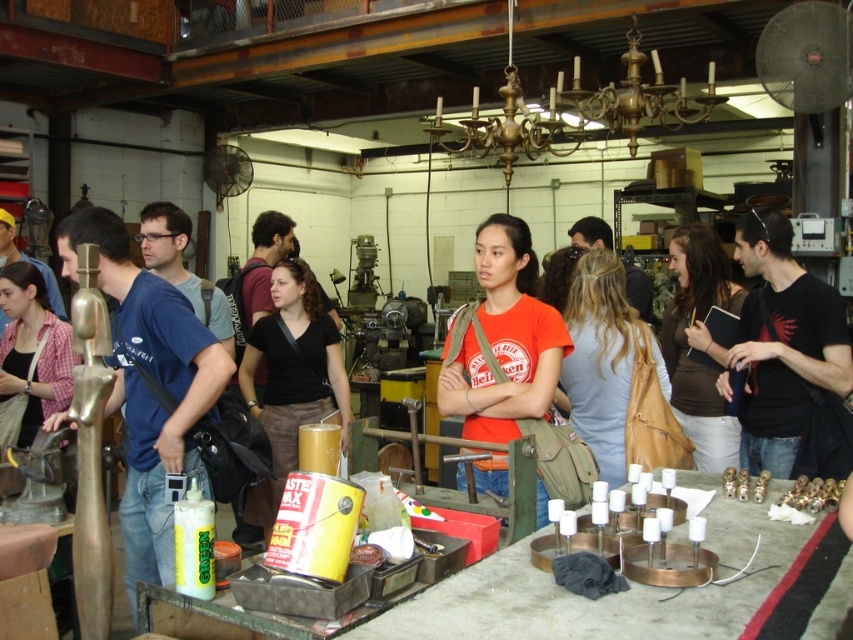
In the scene shown: Does matte gold mannequin at left have a lesser height compared to black matte t-shirt at right?

In fact, matte gold mannequin at left may be taller than black matte t-shirt at right.

Is matte gold mannequin at left to the right of black matte t-shirt at right from the viewer's perspective?

Incorrect, matte gold mannequin at left is not on the right side of black matte t-shirt at right.

Where is `matte gold mannequin at left`? This screenshot has height=640, width=853. matte gold mannequin at left is located at coordinates (146, 387).

Can you confirm if black matte t-shirt at right is wider than light blue fabric at center?

No, black matte t-shirt at right is not wider than light blue fabric at center.

Between point (770, 442) and point (601, 252), which one is positioned behind?

The point (601, 252) is more distant.

What are the coordinates of `black matte t-shirt at right` in the screenshot? It's located at (782, 342).

Is matte gold mannequin at left closer to the viewer compared to orange cotton shirt at center?

No, it is not.

Is matte gold mannequin at left smaller than orange cotton shirt at center?

Incorrect, matte gold mannequin at left is not smaller in size than orange cotton shirt at center.

Where is `matte gold mannequin at left`? The image size is (853, 640). matte gold mannequin at left is located at coordinates (146, 387).

Identify the location of matte gold mannequin at left. This screenshot has width=853, height=640. (146, 387).